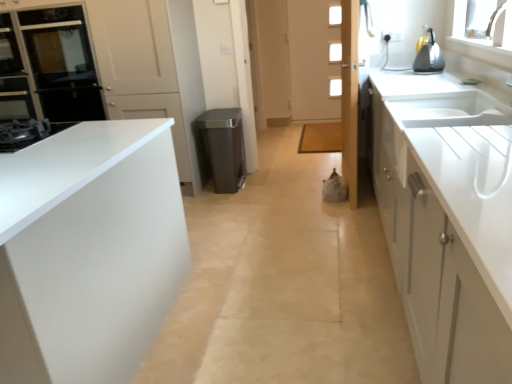
This screenshot has width=512, height=384. I want to click on white glossy door at center, the 2th door when ordered from front to back, so click(x=244, y=81).

What do you see at coordinates (88, 251) in the screenshot?
I see `white matte cabinet at left, which is the second cabinetry in right-to-left order` at bounding box center [88, 251].

What do you see at coordinates (314, 59) in the screenshot? The image size is (512, 384). I see `white wooden door at center, the first door viewed from the back` at bounding box center [314, 59].

Measure the distance between white wooden door at center, positioned as the 1th door in right-to-left order, and camera.

white wooden door at center, positioned as the 1th door in right-to-left order, and camera are 4.89 meters apart.

What is the approximate width of light wood door at center, positioned as the 1th door in front-to-back order?

light wood door at center, positioned as the 1th door in front-to-back order, is 4.26 inches in width.

What is the approximate height of matte black stove at left?

It is 4.38 inches.

Image resolution: width=512 pixels, height=384 pixels. I want to click on black glass oven at upper left, so click(x=62, y=63).

Which object is more forward, black glass oven at upper left or light wood door at center, the third door from the back?

Positioned in front is light wood door at center, the third door from the back.

Which of these two, black glass oven at upper left or light wood door at center, the third door from the back, is bigger?

black glass oven at upper left is bigger.

From a real-world perspective, is black glass oven at upper left above or below light wood door at center, the second door from the right?

In terms of real-world spatial position, black glass oven at upper left is above light wood door at center, the second door from the right.

Which of these two, black glass oven at upper left or light wood door at center, the third door from the back, stands shorter?

With less height is black glass oven at upper left.

Is white wooden door at center, positioned as the 1th door in right-to-left order, placed right next to white matte cabinet at left, which is the second cabinetry in right-to-left order?

There is a gap between white wooden door at center, positioned as the 1th door in right-to-left order, and white matte cabinet at left, which is the second cabinetry in right-to-left order.

Who is smaller, white wooden door at center, the first door viewed from the back, or white matte cabinet at left, which is the 1th cabinetry in left-to-right order?

white wooden door at center, the first door viewed from the back, is smaller.

Does white wooden door at center, the first door viewed from the back, come in front of white matte cabinet at left, which is the second cabinetry in right-to-left order?

No, the depth of white wooden door at center, the first door viewed from the back, is greater than that of white matte cabinet at left, which is the second cabinetry in right-to-left order.

Is metallic silver kettle at upper right at the left side of black glass oven at upper left?

Incorrect, metallic silver kettle at upper right is not on the left side of black glass oven at upper left.

Looking at this image, is black glass oven at upper left surrounded by metallic silver kettle at upper right?

No, black glass oven at upper left is not a part of metallic silver kettle at upper right.

Is metallic silver kettle at upper right turned away from black glass oven at upper left?

No, metallic silver kettle at upper right is not facing away from black glass oven at upper left.

I want to click on kitchen appliance that is on the right side of black glass oven at upper left, so click(428, 55).

Is metallic silver kettle at upper right thinner than white matte cabinet at left, which is the 1th cabinetry in left-to-right order?

Yes, metallic silver kettle at upper right is thinner than white matte cabinet at left, which is the 1th cabinetry in left-to-right order.

Considering the positions of point (422, 64) and point (26, 283), is point (422, 64) closer or farther from the camera than point (26, 283)?

Clearly, point (422, 64) is more distant from the camera than point (26, 283).

Considering the sizes of objects metallic silver kettle at upper right and white matte cabinet at left, which is the 1th cabinetry in left-to-right order, in the image provided, who is shorter, metallic silver kettle at upper right or white matte cabinet at left, which is the 1th cabinetry in left-to-right order,?

metallic silver kettle at upper right is shorter.

Is metallic silver kettle at upper right far from white matte cabinet at left, which is the 1th cabinetry in left-to-right order?

metallic silver kettle at upper right is positioned a significant distance from white matte cabinet at left, which is the 1th cabinetry in left-to-right order.

Can you see matte black stove at left touching black glass oven at upper left?

No, matte black stove at left is not making contact with black glass oven at upper left.

Between point (9, 144) and point (30, 31), which one is positioned in front?

Positioned in front is point (9, 144).

From the image's perspective, which is below, matte black stove at left or black glass oven at upper left?

matte black stove at left.

Is metallic silver kettle at upper right facing towards gray matte trash can at center?

Yes, metallic silver kettle at upper right is aimed at gray matte trash can at center.

Looking at their sizes, would you say metallic silver kettle at upper right is wider or thinner than gray matte trash can at center?

Considering their sizes, metallic silver kettle at upper right looks slimmer than gray matte trash can at center.

How different are the orientations of metallic silver kettle at upper right and gray matte trash can at center in degrees?

The facing directions of metallic silver kettle at upper right and gray matte trash can at center are 178 degrees apart.

Is metallic silver kettle at upper right further to camera compared to gray matte trash can at center?

No, the depth of metallic silver kettle at upper right is less than that of gray matte trash can at center.

Which is more distant, (211, 145) or (258, 167)?

The point (258, 167) is more distant.

Consider the image. Does gray matte trash can at center have a lesser height compared to white glossy door at center, the second door from the back?

Indeed, gray matte trash can at center has a lesser height compared to white glossy door at center, the second door from the back.

Based on the photo, from a real-world perspective, is gray matte trash can at center positioned over white glossy door at center, the second door from the back, based on gravity?

No, from a real-world perspective, gray matte trash can at center is not over white glossy door at center, the second door from the back

Between gray matte trash can at center and white glossy door at center, the 2th door when ordered from front to back, which one has smaller size?

gray matte trash can at center is smaller.

Identify the location of oven above the light wood door at center, the third door from the back (from the image's perspective). (62, 63).

From a real-world perspective, which door is the 2nd one above the white matte cabinet at left, which is the 1th cabinetry in left-to-right order? Please provide its 2D coordinates.

[(314, 59)]

Looking at the image, which one is located closer to white glossy door at center, the 3th door in the right-to-left sequence, light wood door at center, the third door from the back, or white matte cabinet at left, which is the 1th cabinetry in left-to-right order?

→ light wood door at center, the third door from the back.

Which object lies nearer to the anchor point white glossy cabinet at right, which is the first cabinetry in right-to-left order, light wood door at center, the third door from the back, or metallic silver kettle at upper right?

light wood door at center, the third door from the back, is closer to white glossy cabinet at right, which is the first cabinetry in right-to-left order.

Looking at the image, which one is located further to white glossy cabinet at right, which is the second cabinetry from left to right, matte black stove at left or light wood door at center, positioned as the 1th door in front-to-back order?

Among the two, matte black stove at left is located further to white glossy cabinet at right, which is the second cabinetry from left to right.

Based on their spatial positions, is white glossy door at center, the second door from the back, or black glass oven at upper left further from metallic silver kettle at upper right?

black glass oven at upper left is further to metallic silver kettle at upper right.

Based on their spatial positions, is white glossy door at center, the second door from the back, or gray matte trash can at center further from white wooden door at center, the first door viewed from the back?

The object further to white wooden door at center, the first door viewed from the back, is gray matte trash can at center.

Looking at the image, which one is located closer to light wood door at center, the third door from the back, black glass oven at upper left or matte black stove at left?

matte black stove at left.

Considering their positions, is white wooden door at center, arranged as the 3th door when viewed from the front, positioned further to white glossy cabinet at right, which is the first cabinetry in right-to-left order, than matte black stove at left?

The object further to white glossy cabinet at right, which is the first cabinetry in right-to-left order, is white wooden door at center, arranged as the 3th door when viewed from the front.

Which object lies further to the anchor point matte black stove at left, light wood door at center, the third door from the back, or metallic silver kettle at upper right?

Based on the image, metallic silver kettle at upper right appears to be further to matte black stove at left.

The height and width of the screenshot is (384, 512). What are the coordinates of `cabinetry located between matte black stove at left and white glossy cabinet at right, which is the second cabinetry from left to right, in the left-right direction` in the screenshot? It's located at (88, 251).

The image size is (512, 384). I want to click on cabinetry between matte black stove at left and light wood door at center, the 2th door in the left-to-right sequence, from left to right, so click(x=88, y=251).

Locate an element on the screen. This screenshot has width=512, height=384. appliance located between matte black stove at left and white glossy door at center, the 3th door in the right-to-left sequence, in the depth direction is located at coordinates (224, 147).

Find the location of a particular element. cabinetry between white matte cabinet at left, which is the second cabinetry in right-to-left order, and gray matte trash can at center from front to back is located at coordinates (447, 226).